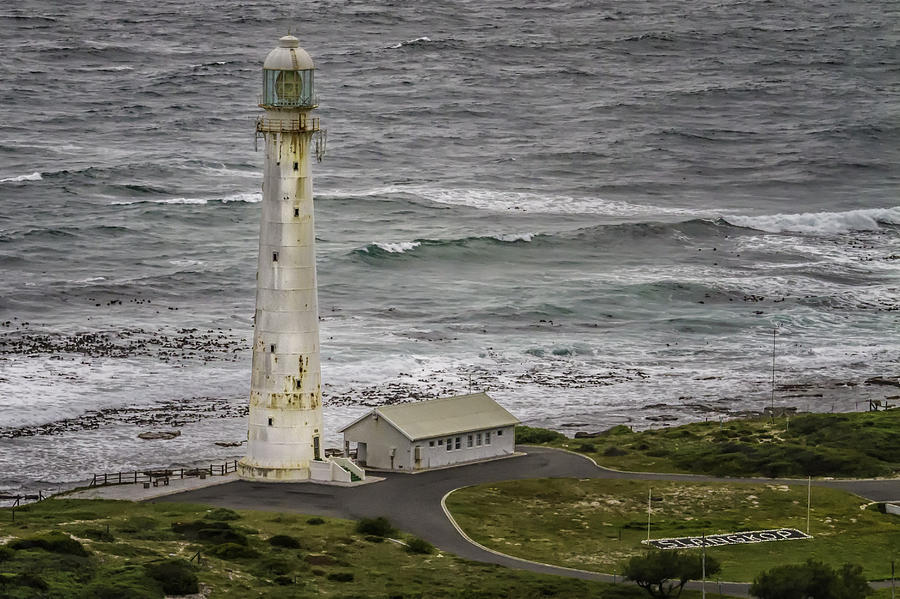
Identify the location of trash bin. (203, 474).